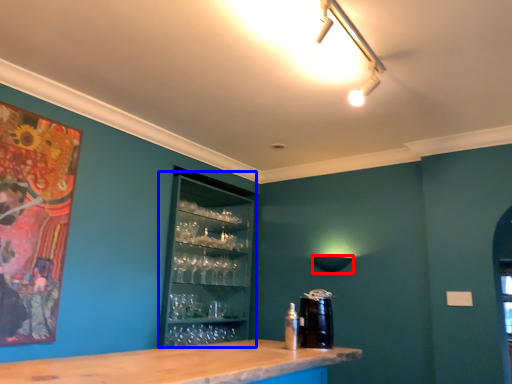
Question: Among these objects, which one is nearest to the camera, lamp (highlighted by a red box) or drink (highlighted by a blue box)?

Choices:
 (A) lamp
 (B) drink

Answer: (B)